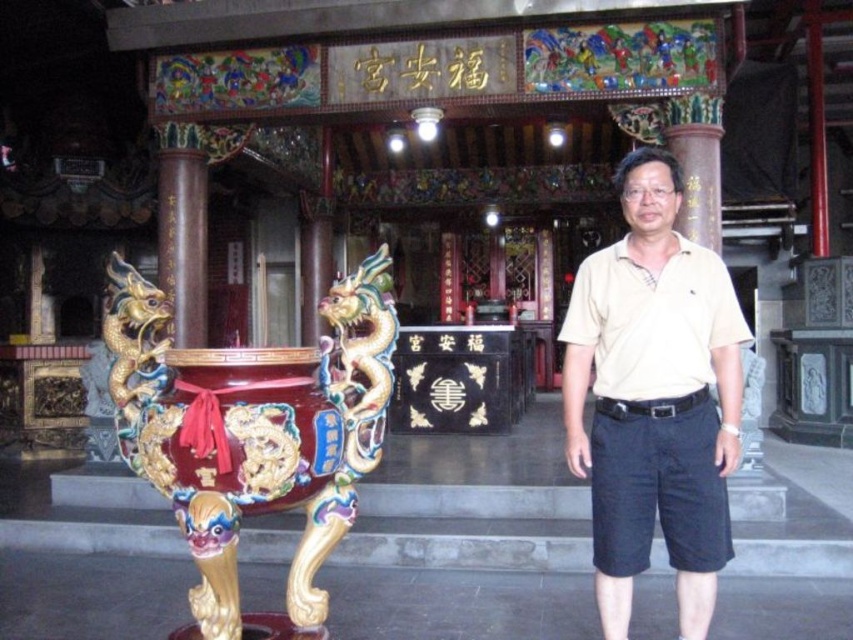
Question: Can you confirm if glossy ceramic incense burner at center is positioned above brown polished wood pillar at center?

Choices:
 (A) yes
 (B) no

Answer: (B)

Question: Considering the relative positions of glossy ceramic incense burner at center and beige cotton polo shirt at center in the image provided, where is glossy ceramic incense burner at center located with respect to beige cotton polo shirt at center?

Choices:
 (A) right
 (B) left

Answer: (B)

Question: Which point is farther to the camera?

Choices:
 (A) (727, 556)
 (B) (158, 154)
 (C) (209, 632)

Answer: (B)

Question: Which object is the closest to the brown polished wood pillar at center?

Choices:
 (A) beige cotton polo shirt at center
 (B) glossy ceramic incense burner at center

Answer: (B)

Question: Does glossy ceramic incense burner at center lie in front of brown polished wood pillar at center?

Choices:
 (A) yes
 (B) no

Answer: (A)

Question: Estimate the real-world distances between objects in this image. Which object is farther from the glossy ceramic incense burner at center?

Choices:
 (A) brown polished wood pillar at center
 (B) beige cotton polo shirt at center

Answer: (A)